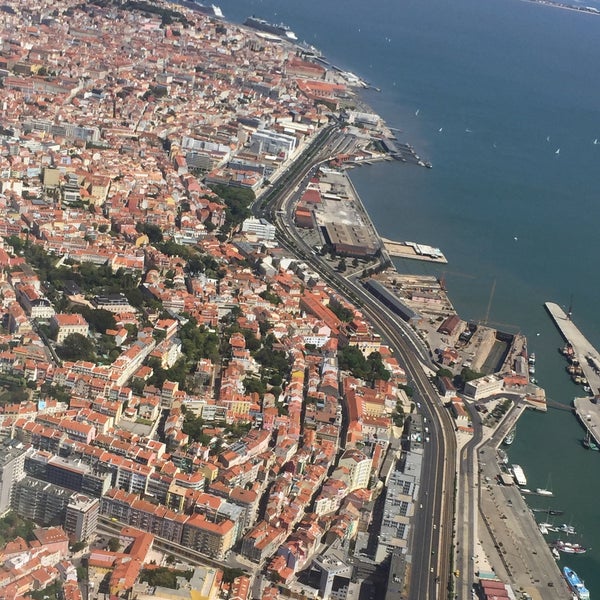
Identify the location of windows. (383, 523), (392, 523), (397, 501).